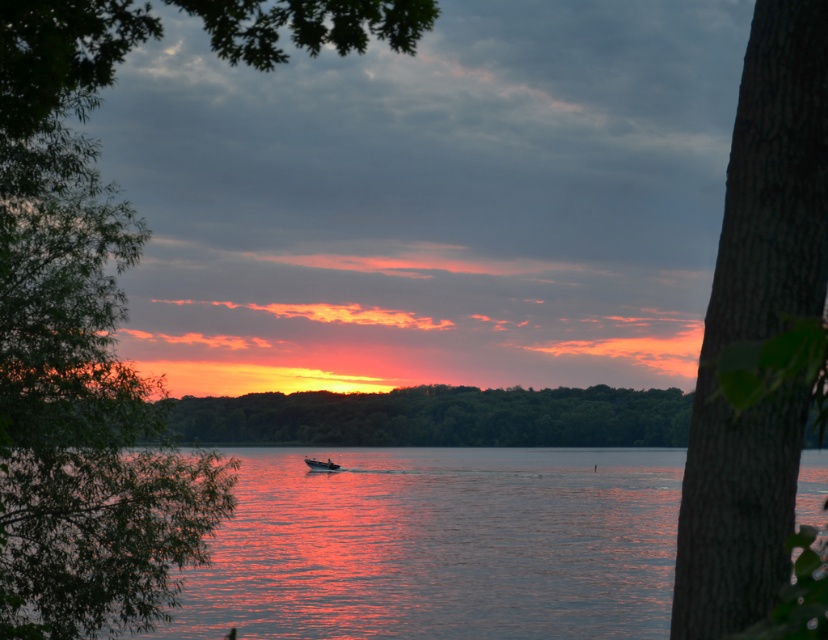
Who is more forward, (309, 48) or (692, 419)?

Point (692, 419) is more forward.

Does green leafy tree at left have a lesser height compared to brown rough bark tree at right?

Incorrect, green leafy tree at left's height does not fall short of brown rough bark tree at right's.

Is point (17, 276) farther from viewer compared to point (721, 410)?

Yes, it is behind point (721, 410).

Where is `green leafy tree at left`? green leafy tree at left is located at coordinates (78, 353).

Who is more forward, (109, 394) or (369, 509)?

Positioned in front is point (109, 394).

Locate an element on the screen. The height and width of the screenshot is (640, 828). green leafy tree at left is located at coordinates (78, 353).

I want to click on green leafy tree at left, so click(78, 353).

Which is more to the right, brown rough bark tree at right or metallic silver boat at center?

Positioned to the right is brown rough bark tree at right.

Between brown rough bark tree at right and metallic silver boat at center, which one has less height?

Standing shorter between the two is metallic silver boat at center.

In the scene shown: Who is more forward, (733,141) or (313,465)?

Point (733,141)

Where is `brown rough bark tree at right`? Image resolution: width=828 pixels, height=640 pixels. brown rough bark tree at right is located at coordinates pyautogui.click(x=756, y=328).